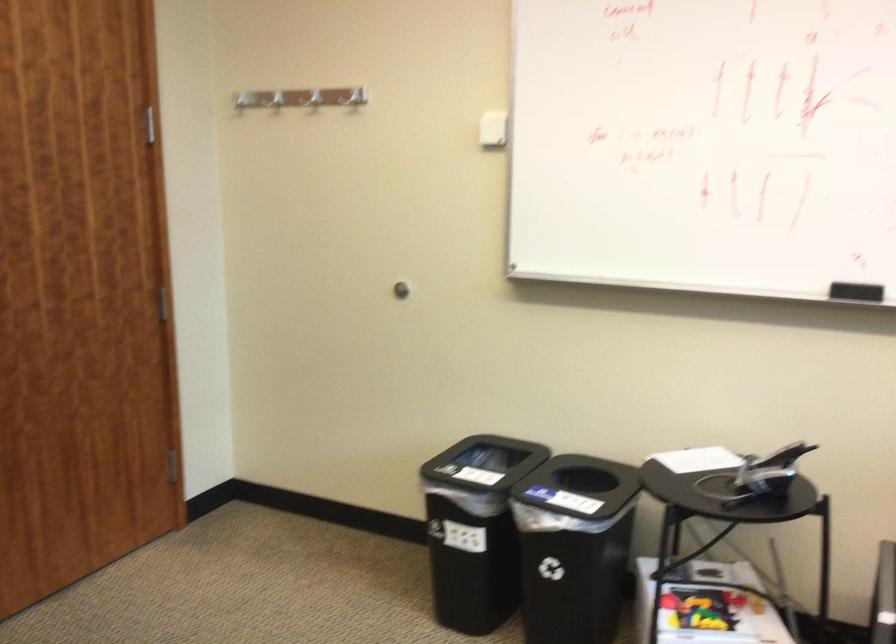
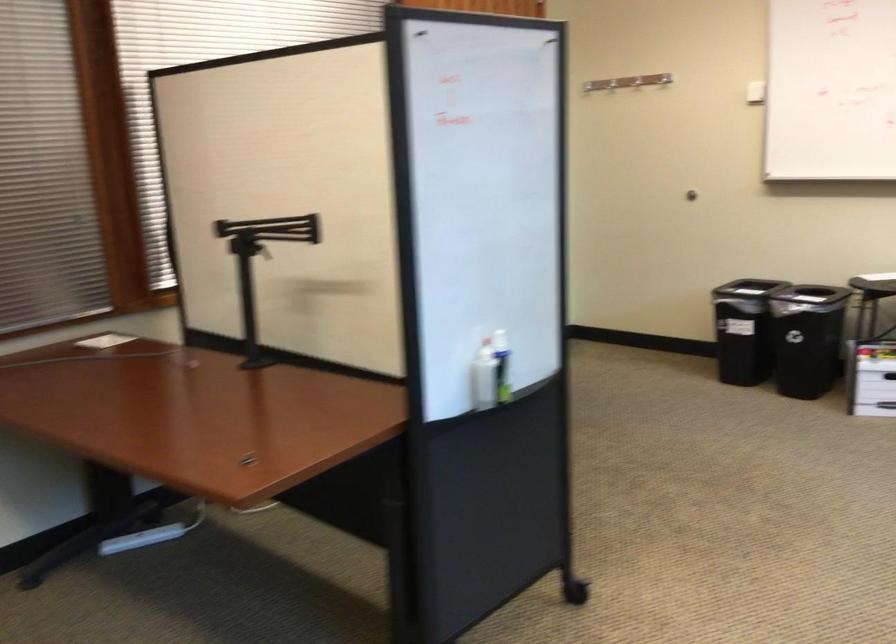
Locate, in the second image, the point that corresponds to pixel 469 114 in the first image.

(664, 79)